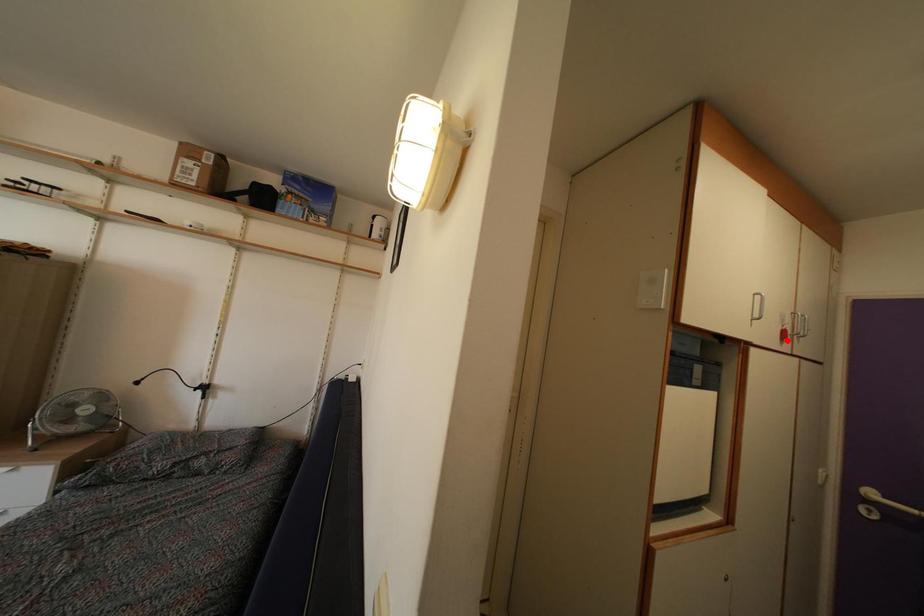
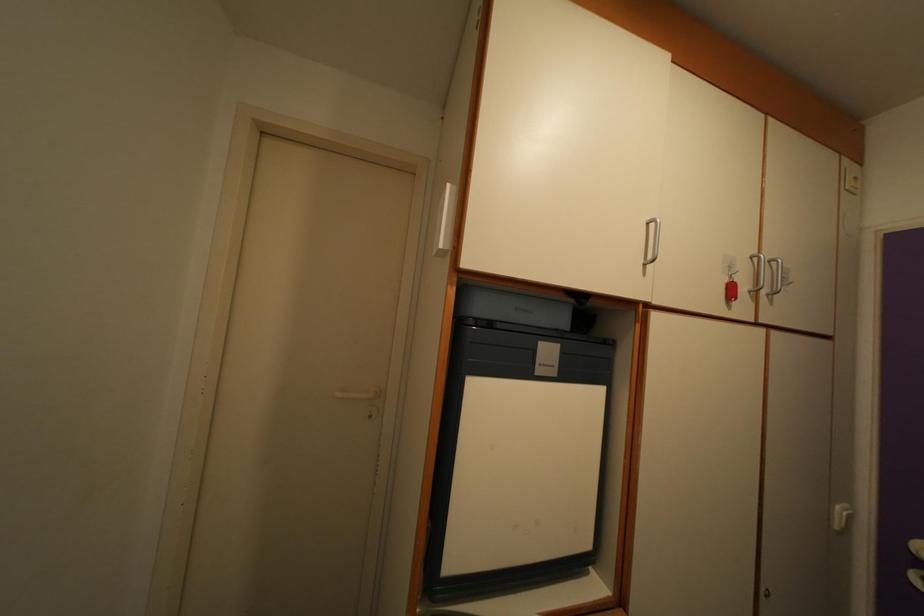
In the second image, find the point that corresponds to the highlighted location in the first image.

(735, 294)